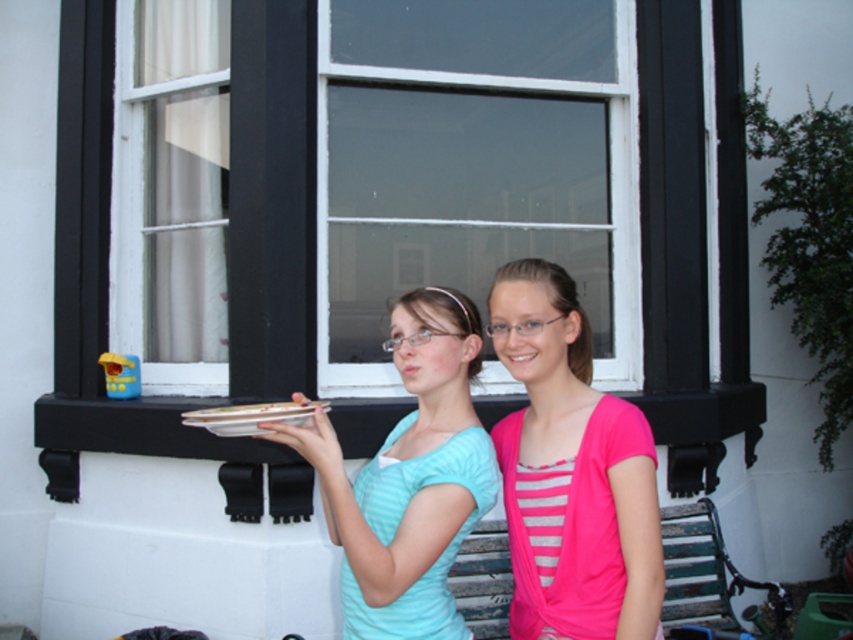
Can you confirm if pink matte cardigan at center is thinner than white glossy platter at center?

Incorrect, pink matte cardigan at center's width is not less than white glossy platter at center's.

Between point (519, 440) and point (270, 420), which one is positioned behind?

The point (519, 440) is behind.

Locate an element on the screen. pink matte cardigan at center is located at coordinates (572, 472).

Is white plastic window at center shorter than light blue striped shirt at center?

Incorrect, white plastic window at center's height does not fall short of light blue striped shirt at center's.

Can you confirm if white plastic window at center is taller than light blue striped shirt at center?

Yes, white plastic window at center is taller than light blue striped shirt at center.

Is point (477, 124) behind point (401, 500)?

Yes.

At what (x,y) coordinates should I click in order to perform the action: click on white plastic window at center. Please return your answer as a coordinate pair (x, y). Looking at the image, I should click on pos(408,211).

Can you confirm if white plastic window at center is taller than white glossy platter at center?

Yes.

Locate an element on the screen. The image size is (853, 640). white plastic window at center is located at coordinates (408, 211).

The width and height of the screenshot is (853, 640). In order to click on white plastic window at center in this screenshot , I will do `click(408, 211)`.